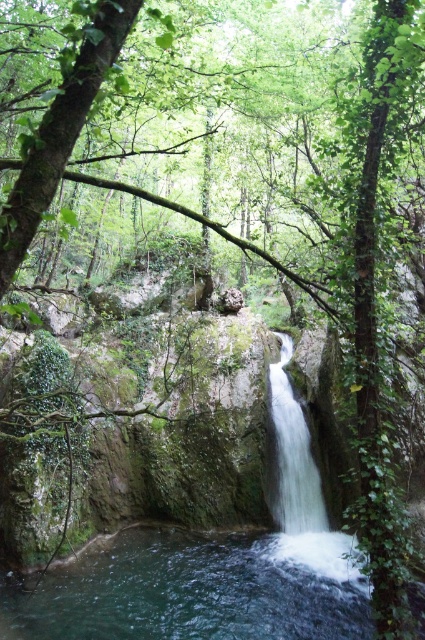
You are standing at the edge of the cliff overlooking the scene. You see the clear water at center and the white smooth waterfall at center. Which one is lower in elevation?

The clear water at center is located below the white smooth waterfall at center, so it is lower in elevation.